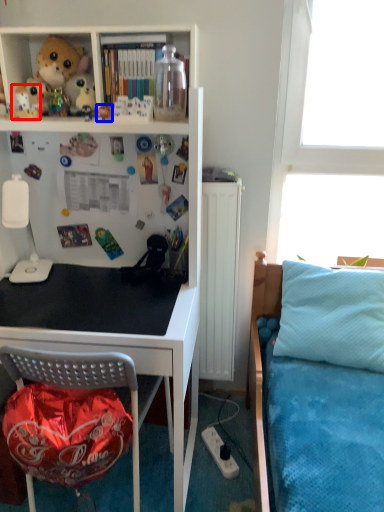
Question: Which object is closer to the camera taking this photo, toy (highlighted by a red box) or toy (highlighted by a blue box)?

Choices:
 (A) toy
 (B) toy

Answer: (B)